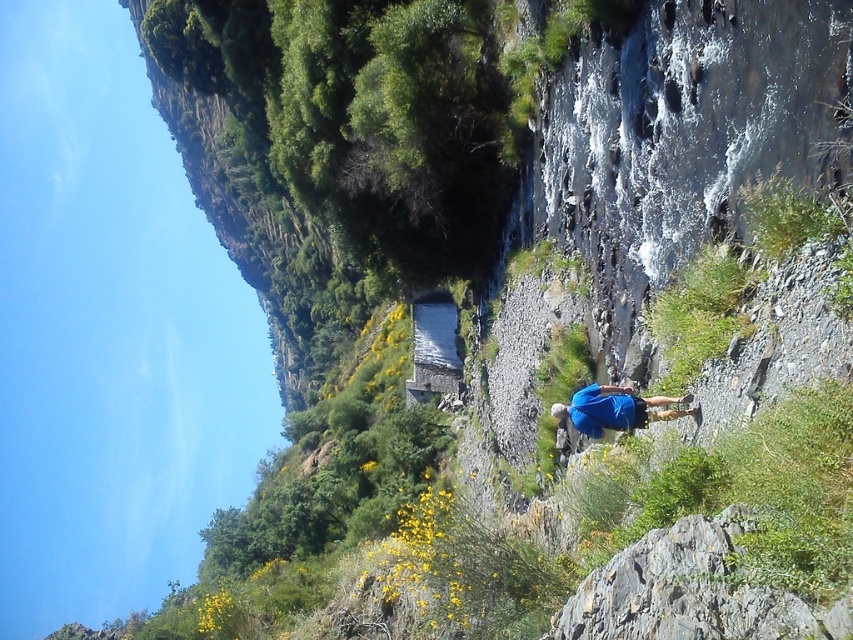
You are a hiker who wants to place your blue fabric shirt at center on top of the gray rough rock at lower right. Based on the scene description, will the rock be able to support the shirt without it falling off?

The gray rough rock at lower right is larger in size than the blue fabric shirt at center, so it should be able to support the shirt without it falling off.